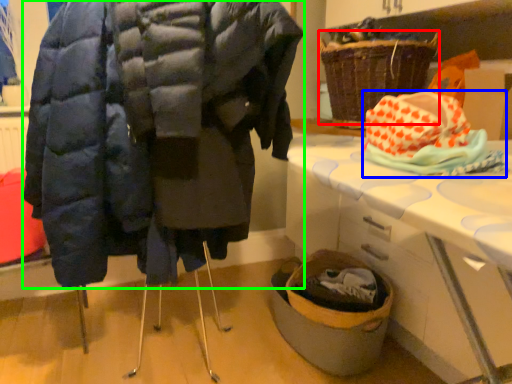
Question: Estimate the real-world distances between objects in this image. Which object is closer to basket (highlighted by a red box), material (highlighted by a blue box) or coat (highlighted by a green box)?

Choices:
 (A) material
 (B) coat

Answer: (B)